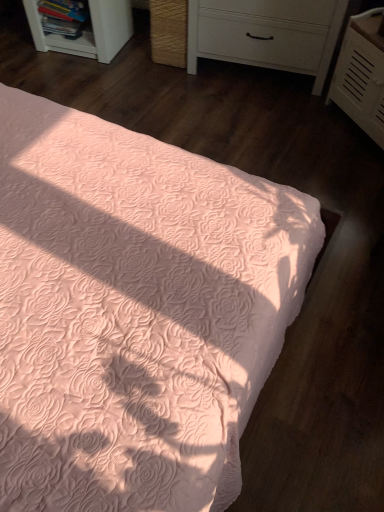
The image size is (384, 512). Identify the location of free space to the left of white textured chest of drawers at upper right, the 2th chest of drawers in the left-to-right sequence. (297, 126).